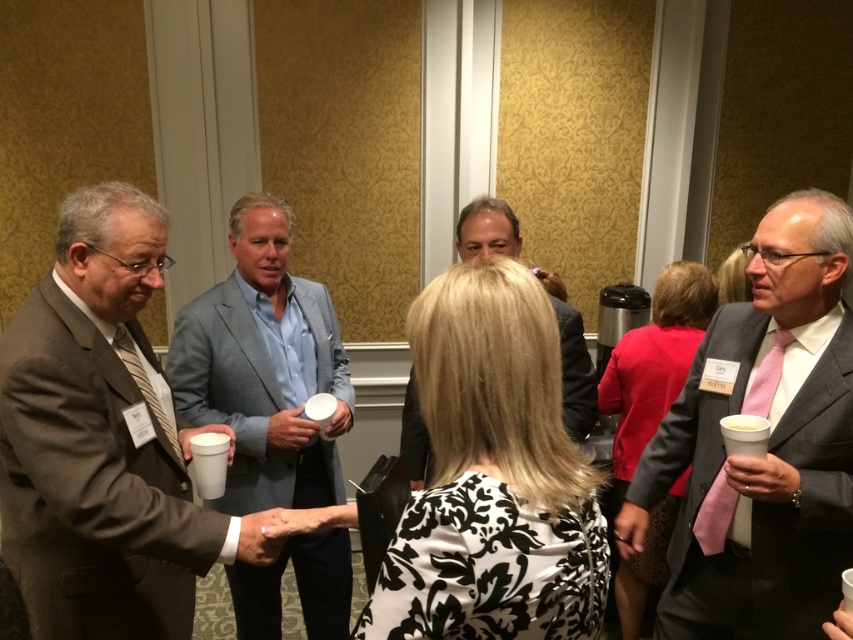
Measure the distance between point [766,387] and camera.

They are 1.56 meters apart.

The width and height of the screenshot is (853, 640). In order to click on matte gray suit at right in this screenshot , I will do `click(769, 444)`.

Who is shorter, matte gray suit at center or white styrofoam cup at lower left?

Standing shorter between the two is white styrofoam cup at lower left.

Can you confirm if matte gray suit at center is positioned to the left of white styrofoam cup at lower left?

Incorrect, matte gray suit at center is not on the left side of white styrofoam cup at lower left.

The width and height of the screenshot is (853, 640). Describe the element at coordinates (573, 371) in the screenshot. I see `matte gray suit at center` at that location.

Locate an element on the screen. Image resolution: width=853 pixels, height=640 pixels. matte gray suit at center is located at coordinates (573, 371).

Is brown wool suit at left bigger than matte gray suit at center?

Yes, brown wool suit at left is bigger than matte gray suit at center.

Does brown wool suit at left lie in front of matte gray suit at center?

Yes.

Between point (41, 372) and point (412, 477), which one is positioned in front?

Point (41, 372) is in front.

I want to click on brown wool suit at left, so click(91, 484).